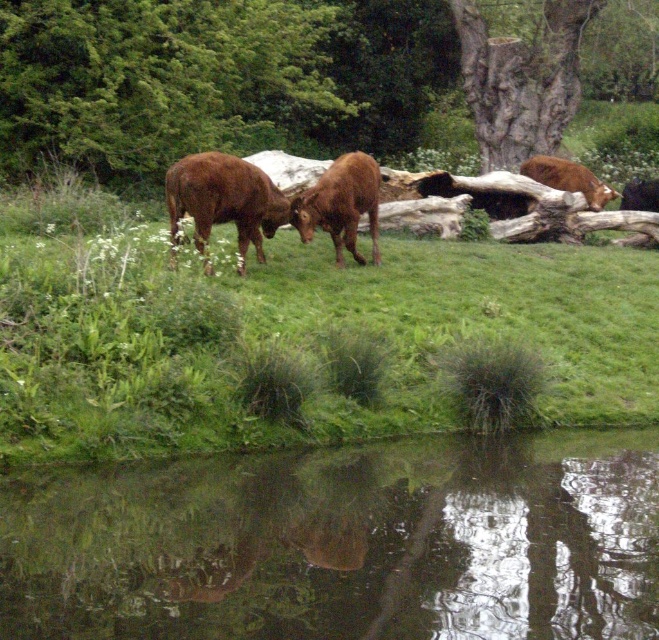
Which is above, brown smooth cow at center or brown matte cow at center?

brown matte cow at center

Between brown smooth cow at center and brown matte cow at center, which one has more height?

With more height is brown matte cow at center.

Is point (188, 193) positioned before point (306, 214)?

Yes.

Identify the location of brown smooth cow at center. The width and height of the screenshot is (659, 640). (223, 198).

Is smooth bark tree trunk at upper center to the right of brown matte cow at center from the viewer's perspective?

Indeed, smooth bark tree trunk at upper center is positioned on the right side of brown matte cow at center.

Is smooth bark tree trunk at upper center above brown matte cow at center?

Correct, smooth bark tree trunk at upper center is located above brown matte cow at center.

Which is in front, point (246, 4) or point (320, 204)?

Positioned in front is point (320, 204).

Find the location of a particular element. smooth bark tree trunk at upper center is located at coordinates (221, 80).

Can you confirm if smooth bark tree at upper center is positioned to the right of brown smooth cow at center?

Correct, you'll find smooth bark tree at upper center to the right of brown smooth cow at center.

Does smooth bark tree at upper center appear over brown smooth cow at center?

Indeed, smooth bark tree at upper center is positioned over brown smooth cow at center.

Is point (554, 136) farther from camera compared to point (221, 198)?

Yes, it is.

Find the location of a particular element. smooth bark tree at upper center is located at coordinates (521, 80).